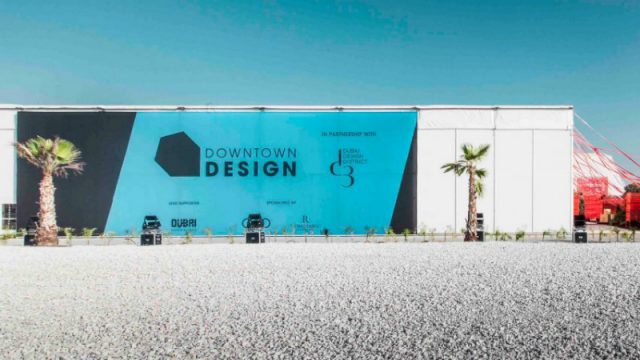
This screenshot has height=360, width=640. I want to click on small plants, so click(x=232, y=232), click(x=208, y=233), click(x=187, y=234), click(x=97, y=232), click(x=294, y=233), click(x=317, y=233), click(x=345, y=233).